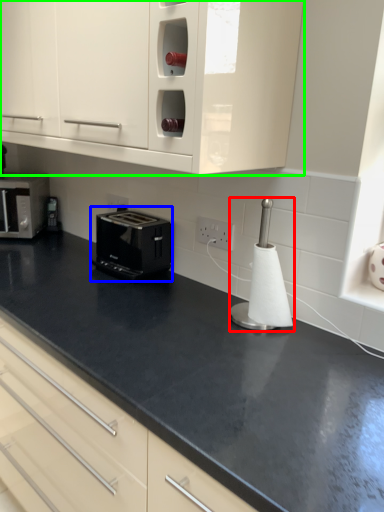
Question: Which object is the closest to the appliance (highlighted by a red box)? Choose among these: toaster (highlighted by a blue box) or cabinetry (highlighted by a green box).

Choices:
 (A) toaster
 (B) cabinetry

Answer: (B)